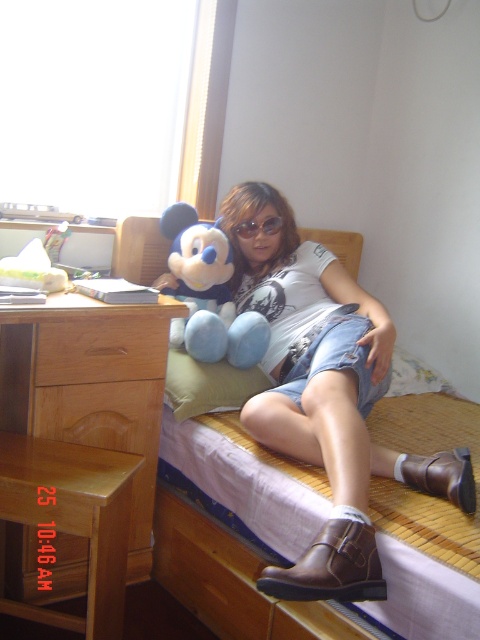
You are a photographer taking a picture of the scene. You want to focus on the denim shorts at center and the blue plush toy at center. Which object should you adjust your camera to focus on first if you want to capture both in the same frame without moving the camera?

The denim shorts at center is located below the blue plush toy at center. To capture both in the same frame without moving the camera, focus on the blue plush toy at center first since it is higher up, allowing the denim shorts at center to naturally fall into the lower part of the frame.

Where is the denim shorts at center located in the image?

The denim shorts at center is located at point [325,396] in the image.